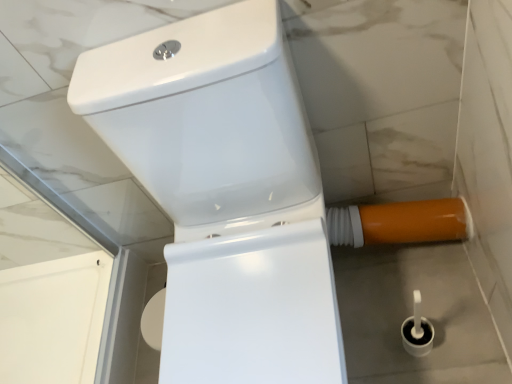
Question: Is the position of white glossy toilet at center more distant than that of orange glossy water pipe at lower right?

Choices:
 (A) no
 (B) yes

Answer: (A)

Question: Is white glossy toilet at center to the right of orange glossy water pipe at lower right from the viewer's perspective?

Choices:
 (A) no
 (B) yes

Answer: (A)

Question: Is white glossy toilet at center next to orange glossy water pipe at lower right?

Choices:
 (A) yes
 (B) no

Answer: (B)

Question: Considering the relative positions of white glossy toilet at center and orange glossy water pipe at lower right in the image provided, is white glossy toilet at center to the left of orange glossy water pipe at lower right from the viewer's perspective?

Choices:
 (A) yes
 (B) no

Answer: (A)

Question: Does white glossy toilet at center turn towards orange glossy water pipe at lower right?

Choices:
 (A) no
 (B) yes

Answer: (A)

Question: From a real-world perspective, is white glossy toilet at center over orange glossy water pipe at lower right?

Choices:
 (A) no
 (B) yes

Answer: (B)

Question: Would you say orange glossy water pipe at lower right is a long distance from white glossy toilet at center?

Choices:
 (A) yes
 (B) no

Answer: (B)

Question: Is orange glossy water pipe at lower right closer to the viewer compared to white glossy toilet at center?

Choices:
 (A) no
 (B) yes

Answer: (A)

Question: From a real-world perspective, is orange glossy water pipe at lower right physically above white glossy toilet at center?

Choices:
 (A) yes
 (B) no

Answer: (B)

Question: Can you confirm if orange glossy water pipe at lower right is smaller than white glossy toilet at center?

Choices:
 (A) yes
 (B) no

Answer: (A)

Question: From a real-world perspective, is orange glossy water pipe at lower right located beneath white glossy toilet at center?

Choices:
 (A) no
 (B) yes

Answer: (B)

Question: Is orange glossy water pipe at lower right thinner than white glossy toilet at center?

Choices:
 (A) no
 (B) yes

Answer: (B)

Question: From the image's perspective, is orange glossy water pipe at lower right positioned above or below white glossy toilet at center?

Choices:
 (A) above
 (B) below

Answer: (A)